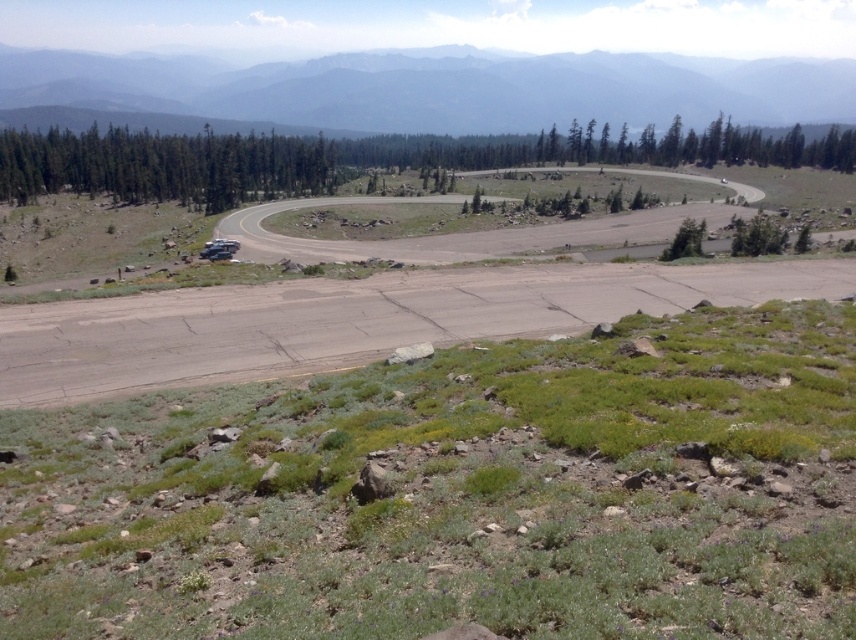
Can you confirm if dirt road at center is positioned to the right of gray foggy mountain at upper center?

Yes, dirt road at center is to the right of gray foggy mountain at upper center.

Between dirt road at center and gray foggy mountain at upper center, which one has less height?

dirt road at center

What do you see at coordinates (355, 320) in the screenshot?
I see `dirt road at center` at bounding box center [355, 320].

Where is `dirt road at center`? This screenshot has height=640, width=856. dirt road at center is located at coordinates (355, 320).